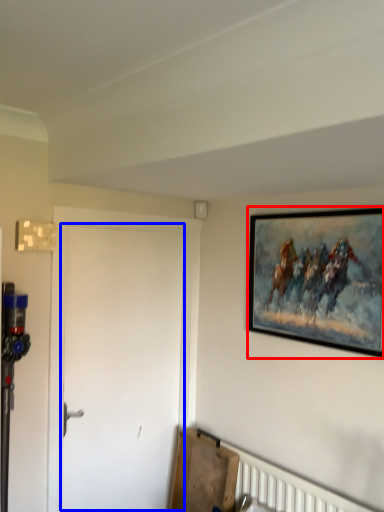
Question: Among these objects, which one is farthest to the camera, picture frame (highlighted by a red box) or door (highlighted by a blue box)?

Choices:
 (A) picture frame
 (B) door

Answer: (B)